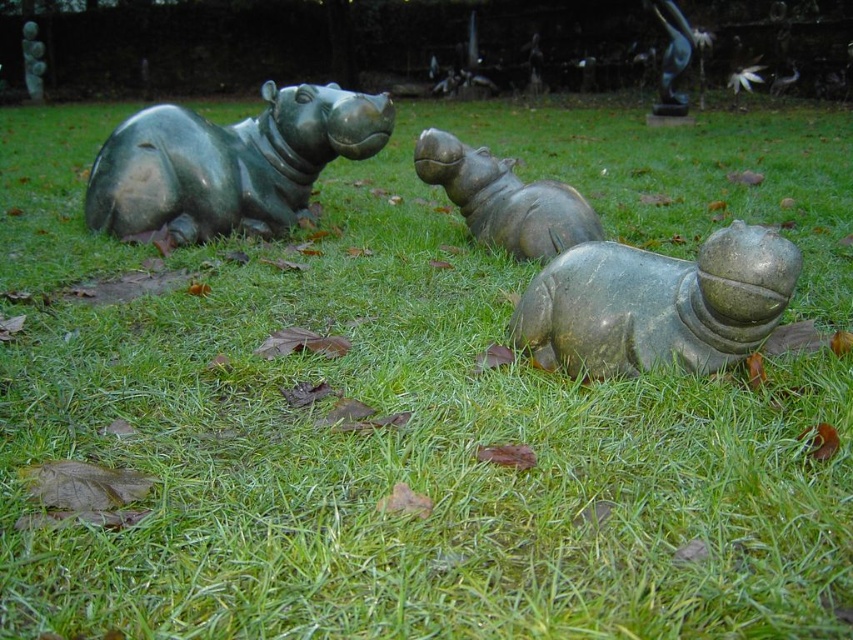
Question: Does green polished hippo at center appear under bronze statue at upper right?

Choices:
 (A) no
 (B) yes

Answer: (B)

Question: Is green polished stone hippo at center below green polished stone hippo at upper left?

Choices:
 (A) no
 (B) yes

Answer: (B)

Question: Estimate the real-world distances between objects in this image. Which object is closer to the green polished hippo at center?

Choices:
 (A) green polished hippo at left
 (B) green polished stone hippo at upper left
 (C) bronze statue at upper right

Answer: (A)

Question: Which object is positioned farthest from the green polished hippo at left?

Choices:
 (A) green polished stone hippo at upper left
 (B) bronze statue at upper right

Answer: (A)

Question: Which of the following is the farthest from the observer?

Choices:
 (A) green polished stone hippo at center
 (B) green polished stone hippo at upper left
 (C) green polished hippo at center
 (D) green polished hippo at left

Answer: (B)

Question: Is green polished hippo at center smaller than green polished stone hippo at upper left?

Choices:
 (A) no
 (B) yes

Answer: (A)